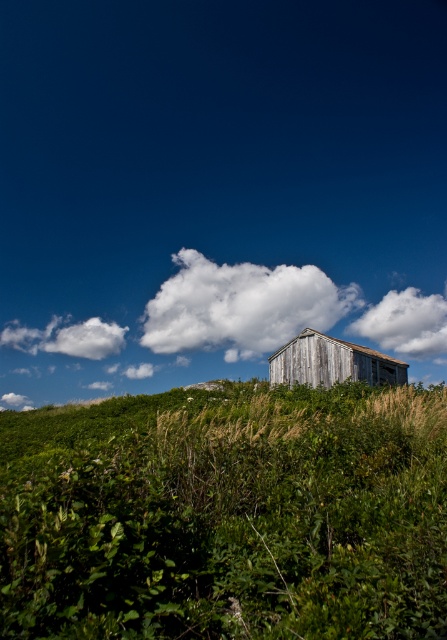
Is white fluffy cloud at upper center wider than white fluffy cloud at upper left?

Incorrect, white fluffy cloud at upper center's width does not surpass white fluffy cloud at upper left's.

Measure the distance between white fluffy cloud at upper center and white fluffy cloud at upper left.

They are 26.10 meters apart.

Which is in front, point (401, 342) or point (28, 346)?

Point (28, 346) is in front.

Where is `white fluffy cloud at upper center`? white fluffy cloud at upper center is located at coordinates (405, 323).

Who is more forward, (375, 538) or (36, 348)?

Positioned in front is point (375, 538).

I want to click on green leafy grass at center, so click(227, 516).

Does green leafy grass at center have a greater height compared to white fluffy cloud at center?

In fact, green leafy grass at center may be shorter than white fluffy cloud at center.

Which is more to the left, green leafy grass at center or white fluffy cloud at center?

Positioned to the left is green leafy grass at center.

Does point (272, 545) come in front of point (274, 275)?

That is True.

Where is `green leafy grass at center`? The width and height of the screenshot is (447, 640). green leafy grass at center is located at coordinates (227, 516).